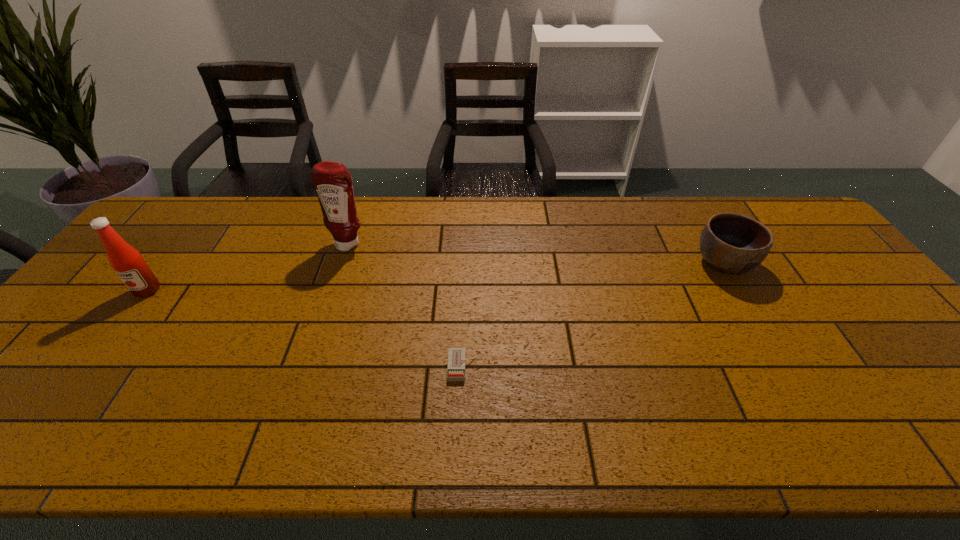
Identify the location of free spot between the leftmost object and the right condiment. (248, 267).

The image size is (960, 540). I want to click on empty location between the second shortest object and the third object from left to right, so click(593, 315).

I want to click on unoccupied position between the farther condiment and the nearest object, so click(406, 305).

Where is `empty space that is in between the shorter condiment and the farther condiment`? The image size is (960, 540). empty space that is in between the shorter condiment and the farther condiment is located at coordinates (248, 267).

This screenshot has width=960, height=540. In order to click on free space between the bowl and the shorter condiment in this screenshot , I will do `click(436, 276)`.

Find the location of a particular element. Image resolution: width=960 pixels, height=540 pixels. empty location between the shortest object and the rightmost object is located at coordinates (593, 315).

Where is `unoccupied area between the bowl and the nearer condiment`? unoccupied area between the bowl and the nearer condiment is located at coordinates (436, 276).

The image size is (960, 540). I want to click on vacant area between the third shortest object and the second shortest object, so click(436, 276).

At what (x,y) coordinates should I click in order to perform the action: click on object that is the closest one to the nearest object. Please return your answer as a coordinate pair (x, y). The height and width of the screenshot is (540, 960). Looking at the image, I should click on [x=333, y=183].

I want to click on the closest object relative to the nearer condiment, so click(x=333, y=183).